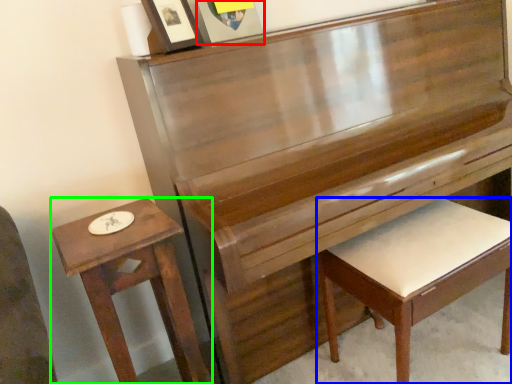
Question: Based on their relative distances, which object is farther from picture frame (highlighted by a red box)? Choose from furniture (highlighted by a blue box) and table (highlighted by a green box).

Choices:
 (A) furniture
 (B) table

Answer: (A)